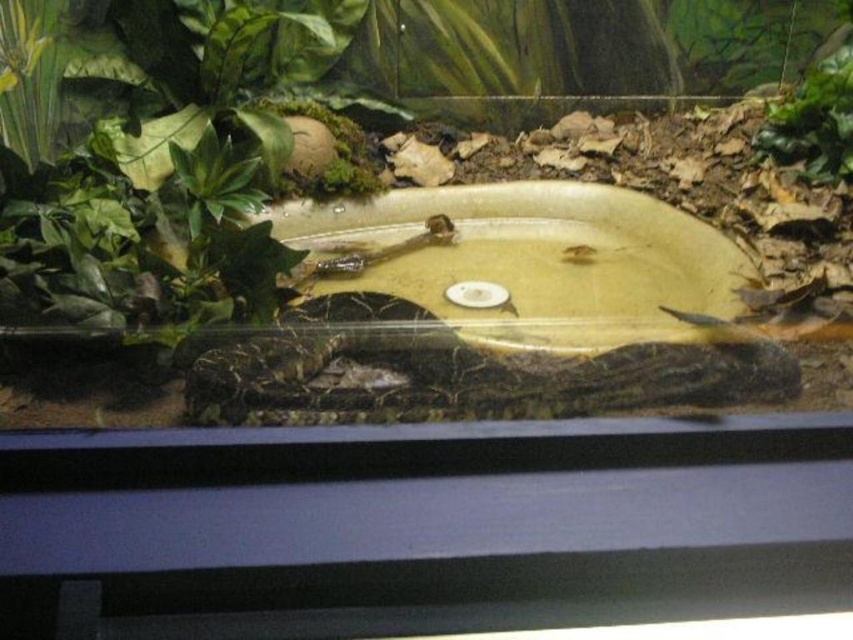
Question: Does leathery brown snake at center have a greater width compared to green matte leaf at upper right?

Choices:
 (A) yes
 (B) no

Answer: (A)

Question: Which of the following is the closest to the observer?

Choices:
 (A) (680, 376)
 (B) (827, 150)

Answer: (A)

Question: Is leathery brown snake at center wider than green matte leaf at upper right?

Choices:
 (A) no
 (B) yes

Answer: (B)

Question: Which point is closer to the camera?

Choices:
 (A) (828, 164)
 (B) (192, 368)

Answer: (B)

Question: Does leathery brown snake at center appear on the right side of green matte leaf at upper right?

Choices:
 (A) no
 (B) yes

Answer: (A)